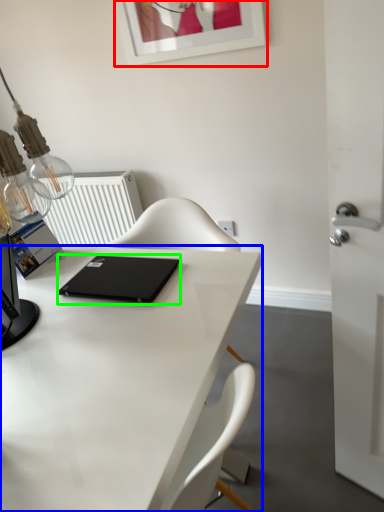
Question: Which is farther away from picture frame (highlighted by a red box)? desk (highlighted by a blue box) or laptop (highlighted by a green box)?

Choices:
 (A) desk
 (B) laptop

Answer: (A)